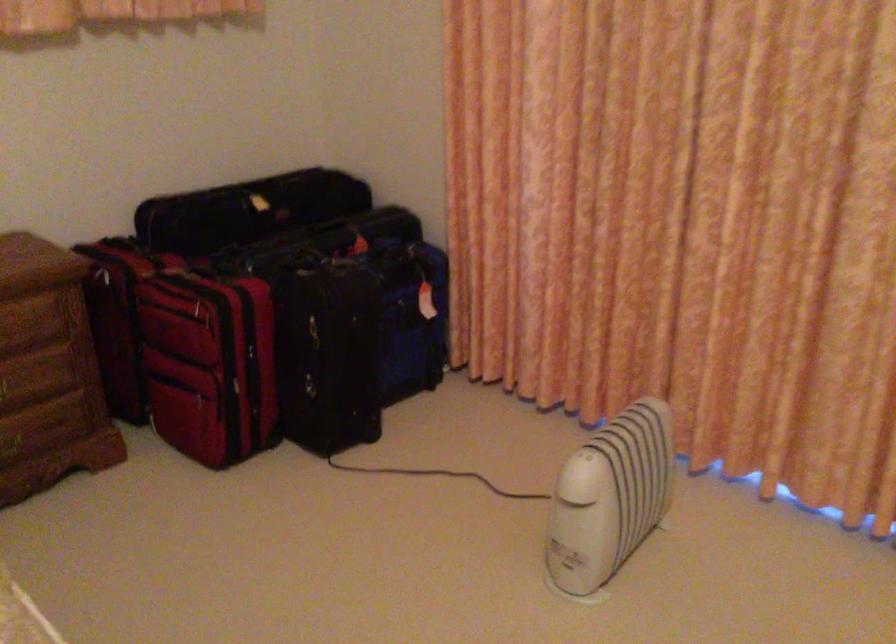
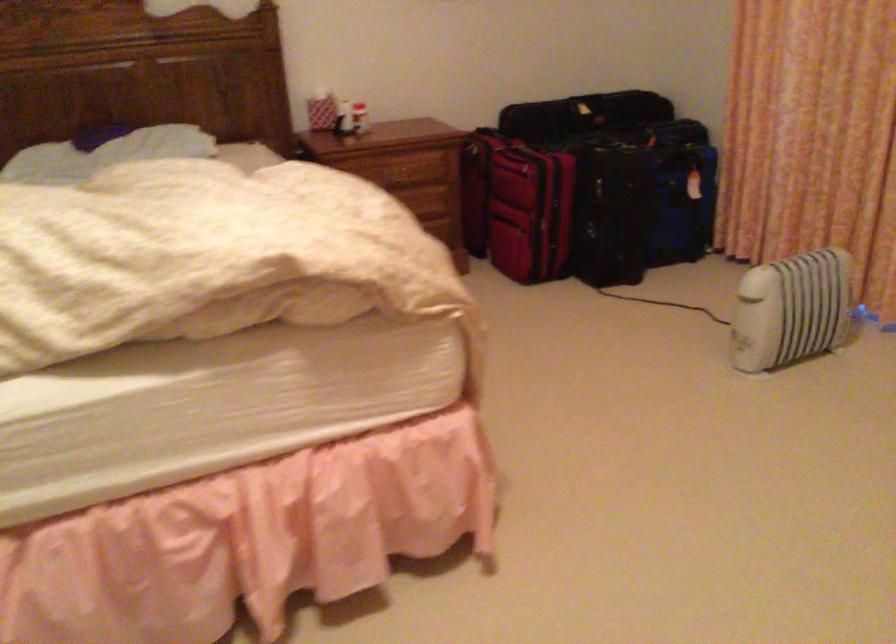
The images are taken continuously from a first-person perspective. In which direction are you moving?

The movement direction of the cameraman is right, backward.